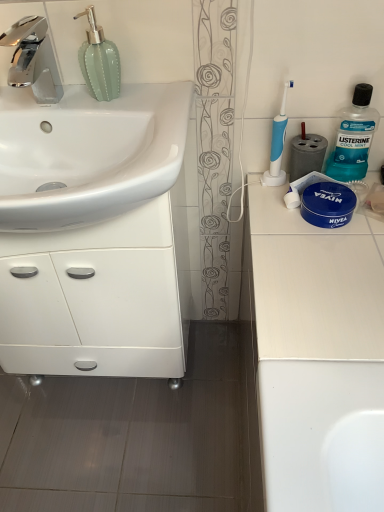
Where is `empty space that is ontop of white matte countertop at right`? The image size is (384, 512). empty space that is ontop of white matte countertop at right is located at coordinates (322, 248).